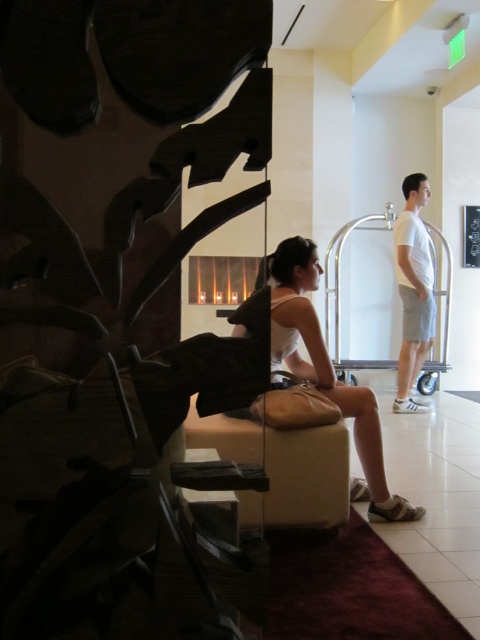
Question: Considering the real-world distances, which object is farthest from the brown leather stool at center?

Choices:
 (A) white matte purse at center
 (B) white matte t-shirt at right

Answer: (B)

Question: Among these objects, which one is nearest to the camera?

Choices:
 (A) white matte purse at center
 (B) brown leather stool at center
 (C) white matte t-shirt at right

Answer: (B)

Question: Is brown leather stool at center below white matte t-shirt at right?

Choices:
 (A) yes
 (B) no

Answer: (A)

Question: Based on their relative distances, which object is farther from the brown leather stool at center?

Choices:
 (A) white matte purse at center
 (B) white matte t-shirt at right

Answer: (B)

Question: Does brown leather stool at center appear on the right side of white matte t-shirt at right?

Choices:
 (A) yes
 (B) no

Answer: (B)

Question: Does brown leather stool at center come in front of white matte purse at center?

Choices:
 (A) yes
 (B) no

Answer: (A)